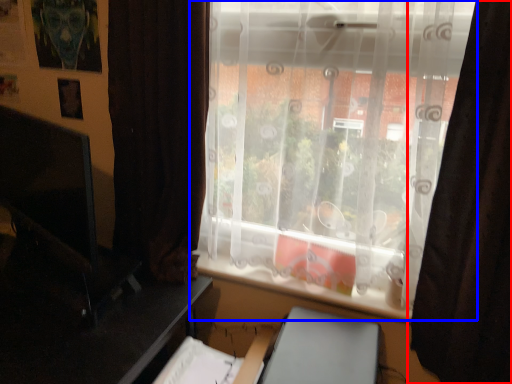
Question: Among these objects, which one is farthest to the camera, curtain (highlighted by a red box) or window (highlighted by a blue box)?

Choices:
 (A) curtain
 (B) window

Answer: (B)